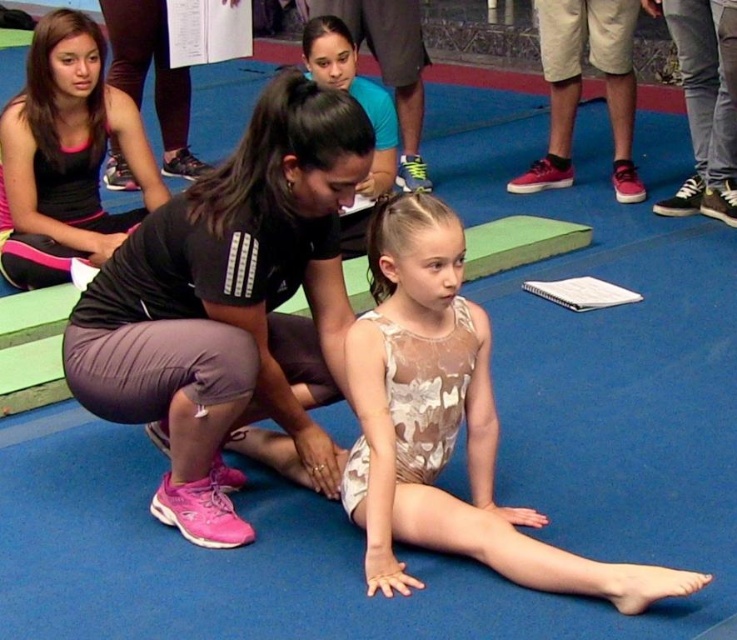
You are a gymnastics coach planning to place a new equipment in the gym. The gym has a coordinate system where the bottom left corner is the origin. The existing equipment is the matte black squat at center. Where should you place the new equipment so it doesn not interfere with the existing one?

The existing matte black squat at center is located at coordinates point (228, 305). To avoid interference, place the new equipment away from this point, ensuring sufficient space between them.

You are a gymnast preparing for a routine. You see the matte black squat at center and the camouflage leotard at center in the gym. Which object is positioned to the left side?

The matte black squat at center is to the left of the camouflage leotard at center.